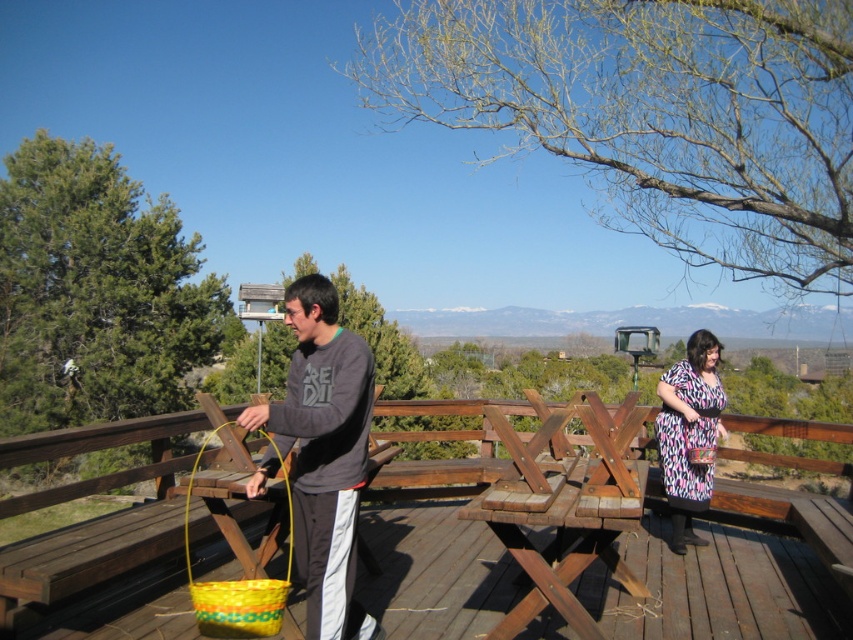
Does wooden picnic table at center appear on the right side of matte yellow basket at center?

In fact, wooden picnic table at center is to the left of matte yellow basket at center.

Measure the distance between point (62,557) and camera.

Point (62,557) and camera are 3.16 meters apart from each other.

Where is `wooden picnic table at center`? This screenshot has width=853, height=640. wooden picnic table at center is located at coordinates (618, 538).

Does matte yellow basket at center lie behind printed fabric dress at right?

That is False.

In the scene shown: How much distance is there between matte yellow basket at center and printed fabric dress at right?

matte yellow basket at center and printed fabric dress at right are 3.20 meters apart.

Where is `matte yellow basket at center`? This screenshot has width=853, height=640. matte yellow basket at center is located at coordinates (323, 454).

The height and width of the screenshot is (640, 853). I want to click on matte yellow basket at center, so (x=323, y=454).

Can you confirm if wooden picnic table at center is positioned below printed fabric dress at right?

Indeed, wooden picnic table at center is positioned under printed fabric dress at right.

Who is taller, wooden picnic table at center or printed fabric dress at right?

printed fabric dress at right is taller.

Does point (630, 588) come in front of point (682, 465)?

Yes, point (630, 588) is in front of point (682, 465).

The height and width of the screenshot is (640, 853). I want to click on wooden picnic table at center, so point(618,538).